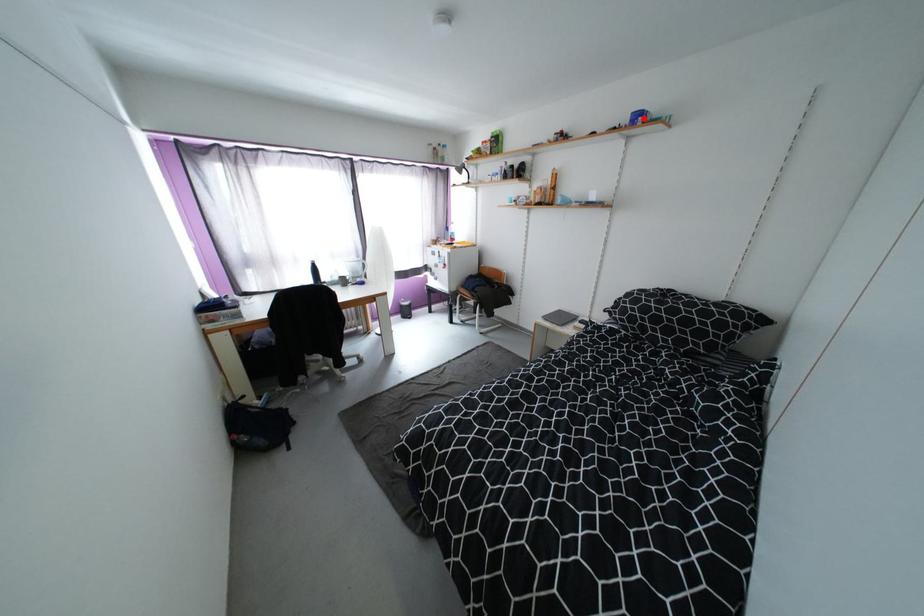
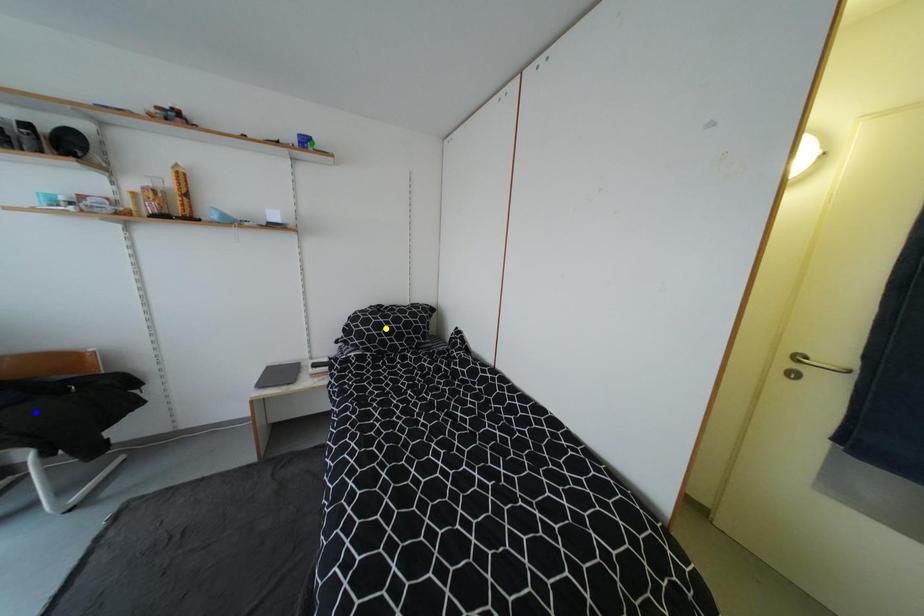
Question: I am providing you with two images of the same scene from different viewpoints. A red point is marked on the first image. You are given multiple points on the second image. Which point in image 2 represents the same 3d spot as the red point in image 1?

Choices:
 (A) blue point
 (B) yellow point
 (C) green point

Answer: (C)